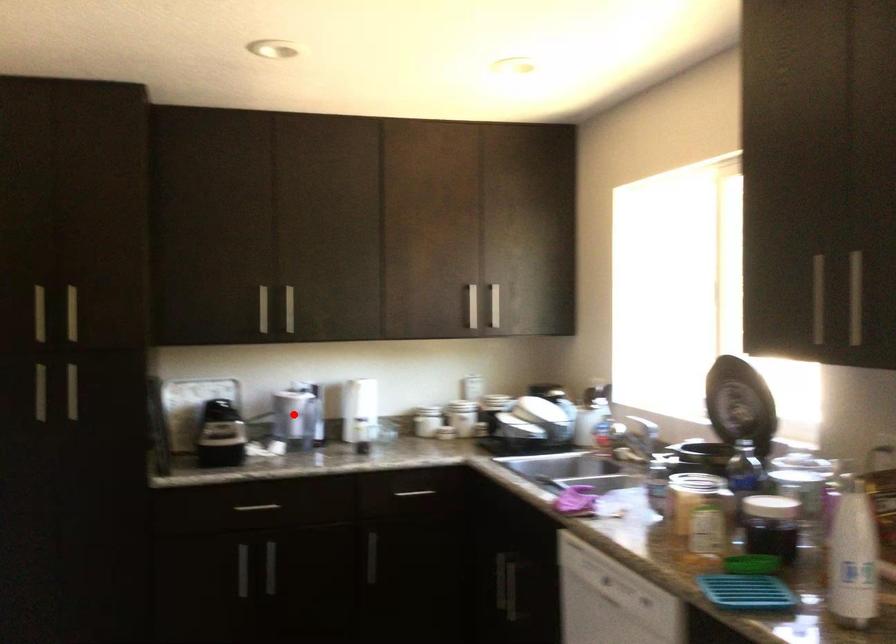
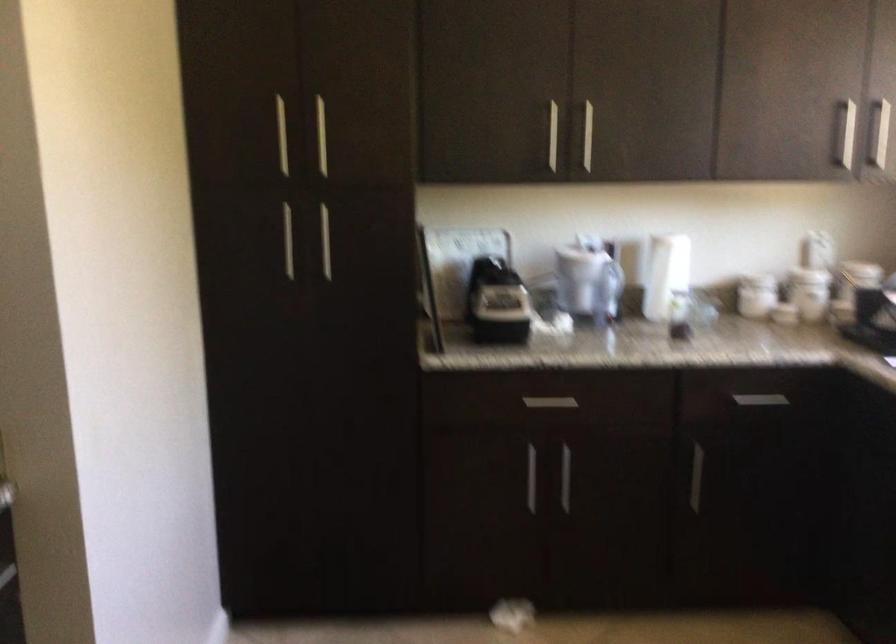
Locate, in the second image, the point that corresponds to the highlighted location in the first image.

(588, 279)